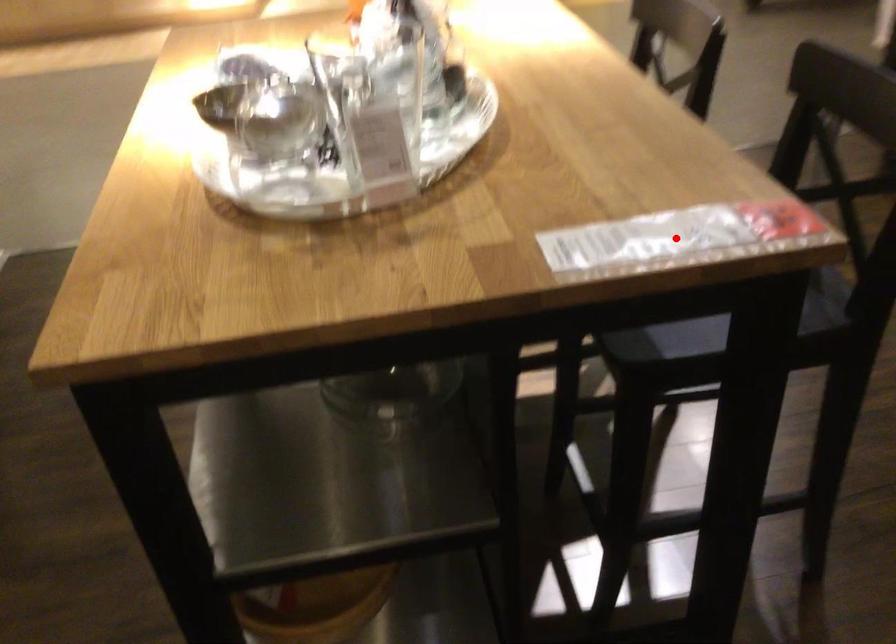
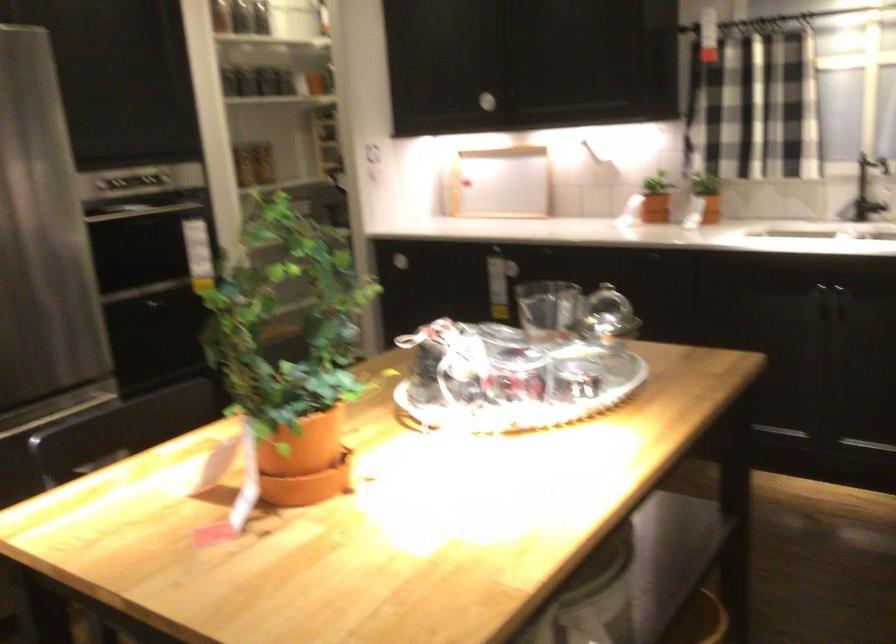
Question: I am providing you with two images of the same scene from different viewpoints. A red point is marked on the first image. Can you still see the location of the red point in image 2?

Choices:
 (A) Yes
 (B) No

Answer: (B)